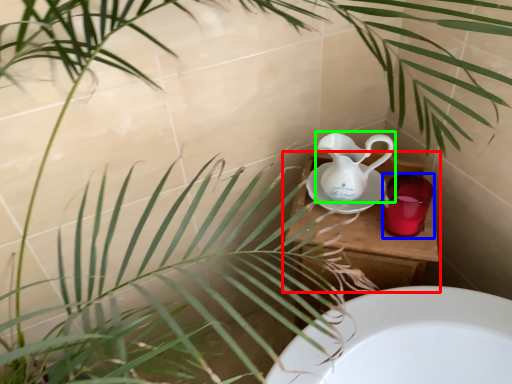
Question: Which is nearer to the table (highlighted by a red box)? mug (highlighted by a blue box) or jug (highlighted by a green box).

Choices:
 (A) mug
 (B) jug

Answer: (A)